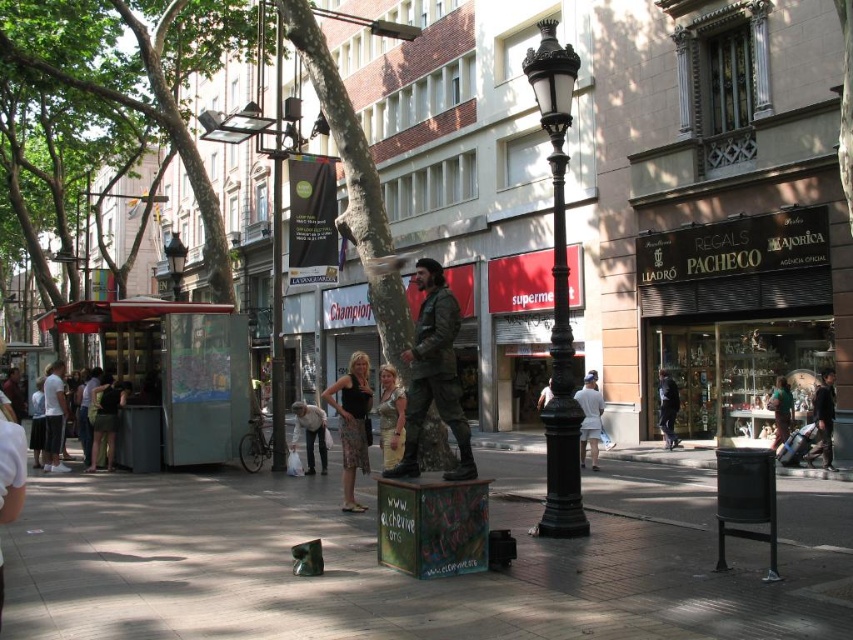
Is black polished metal streetlight at center wider than metallic gold dress at center?

Correct, the width of black polished metal streetlight at center exceeds that of metallic gold dress at center.

Does black polished metal streetlight at center lie behind metallic gold dress at center?

No, black polished metal streetlight at center is in front of metallic gold dress at center.

Does point (549, 497) come behind point (396, 380)?

No, it is not.

Image resolution: width=853 pixels, height=640 pixels. Identify the location of black polished metal streetlight at center. (558, 292).

Can you confirm if metallic streetlamp at upper center is smaller than dark gray fabric jacket at center?

Actually, metallic streetlamp at upper center might be larger than dark gray fabric jacket at center.

Who is higher up, metallic streetlamp at upper center or dark gray fabric jacket at center?

Positioned higher is metallic streetlamp at upper center.

Describe the element at coordinates (271, 186) in the screenshot. I see `metallic streetlamp at upper center` at that location.

I want to click on metallic streetlamp at upper center, so click(x=271, y=186).

Is the position of black glass storefront at center less distant than that of dark green fabric jacket at lower left?

No, it is not.

This screenshot has height=640, width=853. Identify the location of black glass storefront at center. (735, 308).

What are the coordinates of `black glass storefront at center` in the screenshot? It's located at (735, 308).